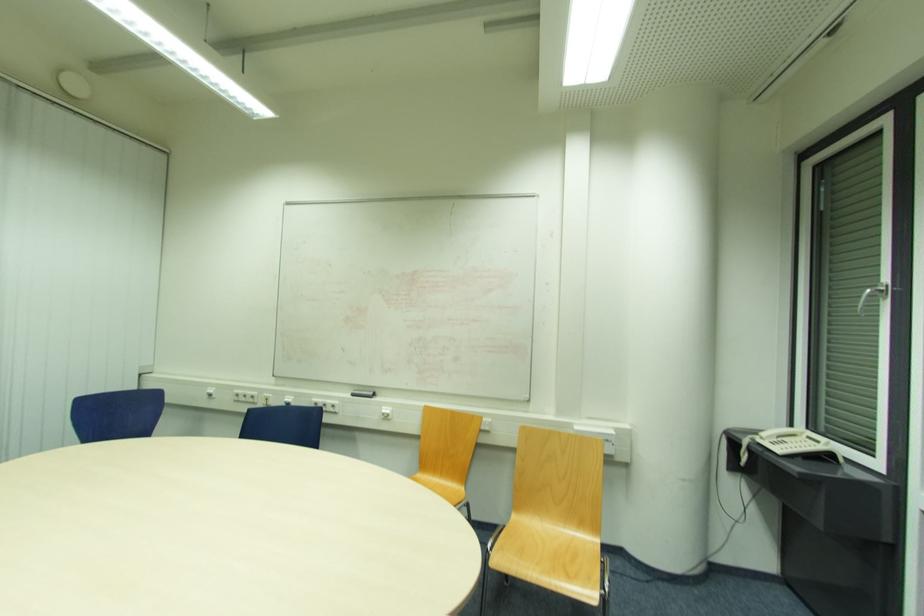
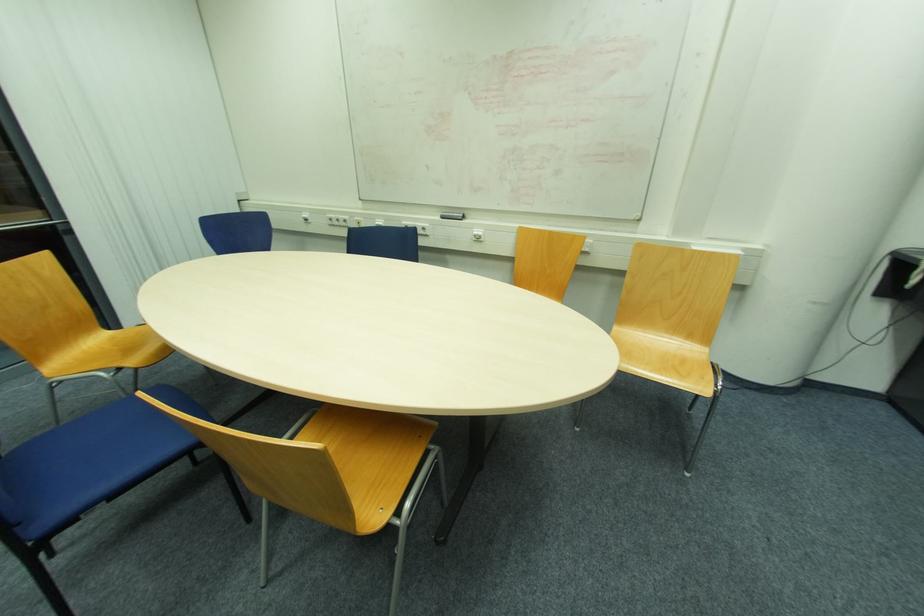
Question: Which direction would the cameraman need to move to produce the second image? Reply with the corresponding letter.

Choices:
 (A) Left
 (B) Right
 (C) Forward
 (D) Backward

Answer: (A)